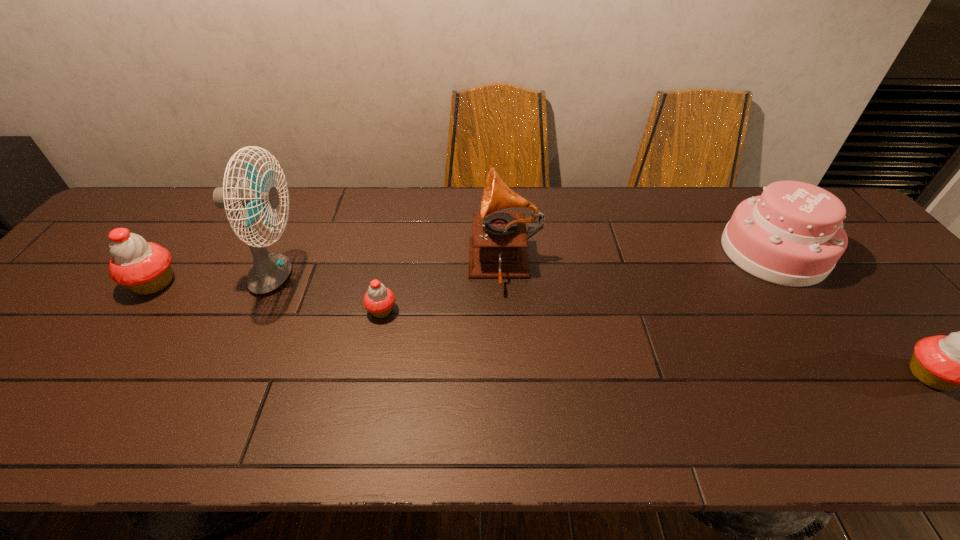
This screenshot has height=540, width=960. I want to click on the leftmost cupcake, so click(143, 267).

You are a GUI agent. You are given a task and a screenshot of the screen. Output one action in this format:
    pyautogui.click(x=<x>, y=<y>)
    Task: Click on the third object from left to right
    
    Given the screenshot: What is the action you would take?
    pyautogui.click(x=379, y=300)

You are a GUI agent. You are given a task and a screenshot of the screen. Output one action in this format:
    pyautogui.click(x=<x>, y=<y>)
    Task: Click on the shortest cupcake
    The width and height of the screenshot is (960, 540).
    Given the screenshot: What is the action you would take?
    pyautogui.click(x=379, y=300)

Where is `the fifth object from right to left`? This screenshot has width=960, height=540. the fifth object from right to left is located at coordinates (269, 270).

Identify the location of fan. (269, 270).

Find the location of a particular element. The width and height of the screenshot is (960, 540). birthday cake is located at coordinates (792, 235).

I want to click on the second tallest object, so click(x=498, y=247).

Identify the location of the third object from right to left. (498, 247).

At what (x,y) coordinates should I click in order to perform the action: click on vacant position located on the back of the leftmost cupcake. Please return your answer as a coordinate pair (x, y). Looking at the image, I should click on (181, 246).

This screenshot has height=540, width=960. In order to click on free location located on the right of the second cupcake from right to left in this screenshot , I will do `click(519, 310)`.